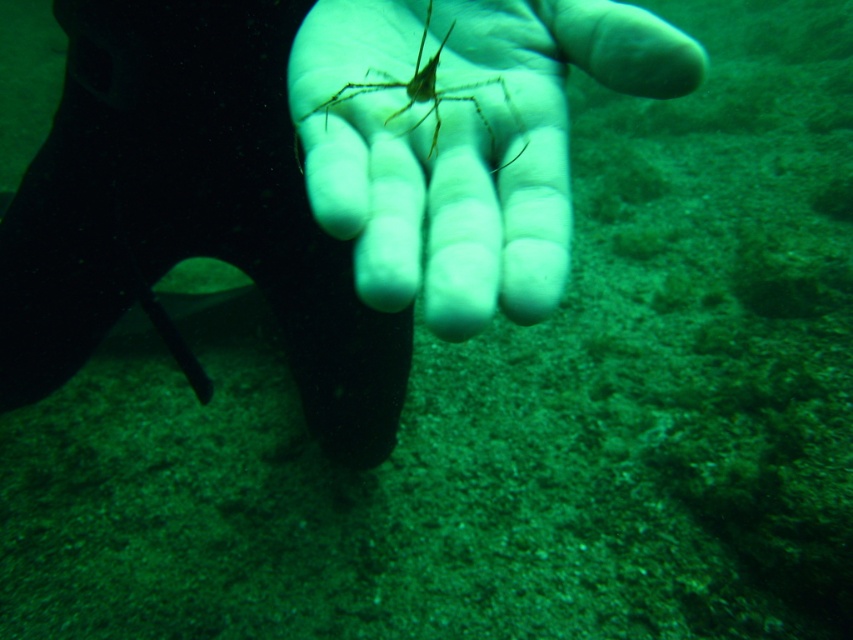
You are a marine biologist examining an underwater image. You notice two points marked in the scene. The first point is at coordinates point (468,118) and the second is at point (625,49). From your vantage point, which point is closer to you?

Point (625,49) is closer to you because point (468,118) is behind it.